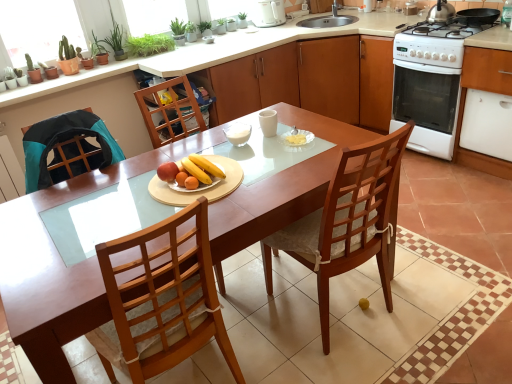
Where is `free location in front of smooth wooden plate with fruits at center, the second fruit dish from the right`? free location in front of smooth wooden plate with fruits at center, the second fruit dish from the right is located at coordinates (170, 214).